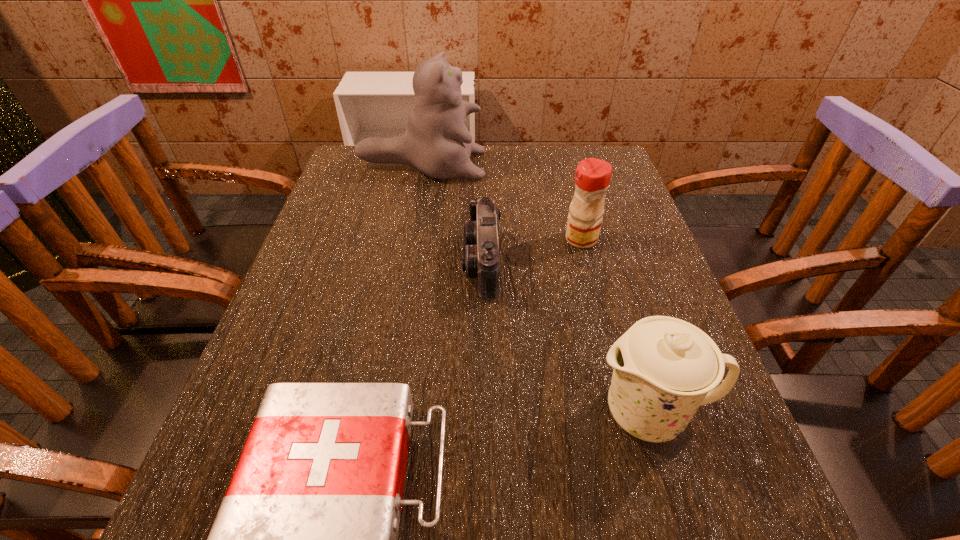
Find the location of `the farthest object`. the farthest object is located at coordinates (436, 142).

Find the location of a particular element. The height and width of the screenshot is (540, 960). the tallest object is located at coordinates (436, 142).

The width and height of the screenshot is (960, 540). In order to click on condiment in this screenshot , I will do `click(592, 178)`.

This screenshot has width=960, height=540. I want to click on chinaware, so click(664, 368).

At what (x,y) coordinates should I click in order to perform the action: click on the second shortest object. Please return your answer as a coordinate pair (x, y). Looking at the image, I should click on (481, 259).

Locate an element on the screen. vacant area located 0.350m on the face of the cat is located at coordinates (605, 166).

At what (x,y) coordinates should I click in order to perform the action: click on vacant space located 0.060m on the front of the condiment. Please return your answer as a coordinate pair (x, y). Looking at the image, I should click on (588, 267).

Where is `free space located on the spout of the chinaware`? free space located on the spout of the chinaware is located at coordinates (375, 413).

Where is `vacant space situated 0.150m on the spout of the chinaware`? vacant space situated 0.150m on the spout of the chinaware is located at coordinates (498, 413).

This screenshot has height=540, width=960. I want to click on blank space located 0.280m on the spout of the chinaware, so click(419, 413).